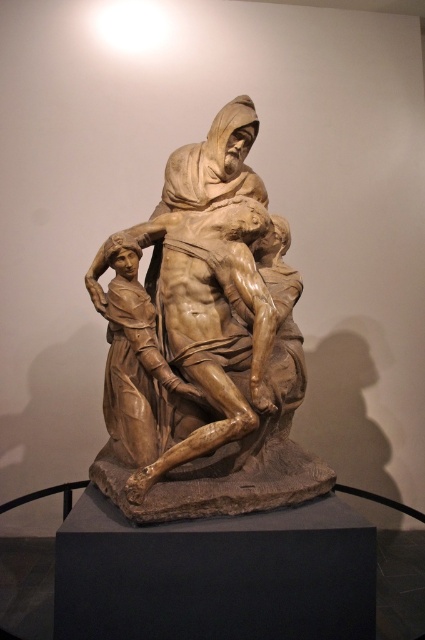
Is brown wood sculpture at center taller than brown wood statue at center?

Indeed, brown wood sculpture at center has a greater height compared to brown wood statue at center.

Does brown wood sculpture at center have a greater width compared to brown wood statue at center?

Correct, the width of brown wood sculpture at center exceeds that of brown wood statue at center.

Locate an element on the screen. The height and width of the screenshot is (640, 425). brown wood sculpture at center is located at coordinates (206, 346).

What are the coordinates of `brown wood sculpture at center` in the screenshot? It's located at (206, 346).

Measure the distance between wooden sculpture of man at center and camera.

wooden sculpture of man at center is 2.76 meters away from camera.

Which is behind, point (184, 262) or point (110, 296)?

The point (110, 296) is behind.

The image size is (425, 640). In order to click on wooden sculpture of man at center in this screenshot , I will do `click(210, 323)`.

Is point (104, 449) farther from camera compared to point (237, 220)?

Yes, point (104, 449) is behind point (237, 220).

In the scene shown: Is brown wood sculpture at center wider than wooden sculpture of man at center?

Indeed, brown wood sculpture at center has a greater width compared to wooden sculpture of man at center.

Between point (158, 515) and point (172, 218), which one is positioned behind?

Positioned behind is point (172, 218).

Identify the location of brown wood sculpture at center. (206, 346).